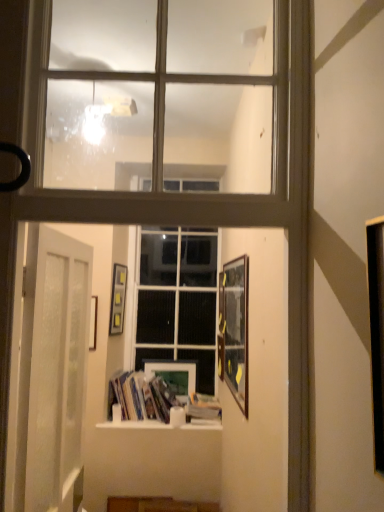
You are a GUI agent. You are given a task and a screenshot of the screen. Output one action in this format:
    pyautogui.click(x=<x>, y=<y>)
    Task: Click on the clear glass window at center
    This screenshot has height=512, width=384.
    Given the screenshot: What is the action you would take?
    pyautogui.click(x=178, y=298)

This screenshot has width=384, height=512. What are the coordinates of `matte wooden picture frame at center, the second picture frame in the right-to-left sequence` in the screenshot? It's located at (174, 374).

Image resolution: width=384 pixels, height=512 pixels. Find the location of `hardcover book at center`. hardcover book at center is located at coordinates (203, 408).

Find the location of `matte black picture frame at center, which ranks as the 2th picture frame in front-to-back order`. matte black picture frame at center, which ranks as the 2th picture frame in front-to-back order is located at coordinates (118, 298).

You are a GUI agent. You are given a task and a screenshot of the screen. Output one action in this format:
    pyautogui.click(x=<x>, y=<y>)
    Task: Click on the clear glass window at upper center
    
    Given the screenshot: What is the action you would take?
    pyautogui.click(x=219, y=93)

From a real-world perspective, which is physically above, clear glass window at center or matte wooden picture frame at center, the first picture frame viewed from the back?

clear glass window at center is physically above.

Between clear glass window at center and matte wooden picture frame at center, the second picture frame in the right-to-left sequence, which one has more height?

clear glass window at center is taller.

How many degrees apart are the facing directions of clear glass window at center and matte wooden picture frame at center, the second picture frame in the right-to-left sequence?

The facing directions of clear glass window at center and matte wooden picture frame at center, the second picture frame in the right-to-left sequence, are 0.317 degrees apart.

Considering the positions of objects clear glass window at center and matte wooden picture frame at center, which is counted as the 3th picture frame, starting from the front, in the image provided, who is in front, clear glass window at center or matte wooden picture frame at center, which is counted as the 3th picture frame, starting from the front,?

clear glass window at center.

Could you tell me if matte black picture frame at center, which ranks as the second picture frame in back-to-front order, is facing matte wooden picture frame at center, which is counted as the 3th picture frame, starting from the front?

No.

Is matte black picture frame at center, which ranks as the 2th picture frame in front-to-back order, further to the viewer compared to matte wooden picture frame at center, arranged as the 2th picture frame when viewed from the left?

No, matte black picture frame at center, which ranks as the 2th picture frame in front-to-back order, is closer to the viewer.

You are a GUI agent. You are given a task and a screenshot of the screen. Output one action in this format:
    pyautogui.click(x=<x>, y=<y>)
    Task: Click on the 2nd picture frame above the matte wooden picture frame at center, which is counted as the 3th picture frame, starting from the front (from the image's perspective)
    This screenshot has height=512, width=384.
    Given the screenshot: What is the action you would take?
    pyautogui.click(x=118, y=298)

Is matte black picture frame at center, which ranks as the second picture frame in back-to-front order, placed right next to matte wooden picture frame at center, the first picture frame viewed from the back?

There is a gap between matte black picture frame at center, which ranks as the second picture frame in back-to-front order, and matte wooden picture frame at center, the first picture frame viewed from the back.

Is hardcover book at center bigger or smaller than matte wooden picture frame at center, arranged as the 2th picture frame when viewed from the left?

hardcover book at center is bigger than matte wooden picture frame at center, arranged as the 2th picture frame when viewed from the left.

How many degrees apart are the facing directions of hardcover book at center and matte wooden picture frame at center, the second picture frame in the right-to-left sequence?

0.753 degrees.

Is the position of hardcover book at center less distant than that of matte wooden picture frame at center, the first picture frame viewed from the back?

Yes, hardcover book at center is closer to the viewer.

Could you tell me if hardcover book at center is turned towards matte wooden picture frame at center, arranged as the 2th picture frame when viewed from the left?

No.

Is clear glass window at center wider or thinner than hardcover books at center?

In the image, clear glass window at center appears to be more narrow than hardcover books at center.

From a real-world perspective, is clear glass window at center located beneath hardcover books at center?

No, from a real-world perspective, clear glass window at center is not under hardcover books at center.

Considering the positions of point (138, 369) and point (168, 410), is point (138, 369) closer or farther from the camera than point (168, 410)?

Point (138, 369) appears to be farther away from the viewer than point (168, 410).

How different are the orientations of clear glass window at upper center and matte wooden picture frame at center, the second picture frame in the right-to-left sequence, in degrees?

The angular difference between clear glass window at upper center and matte wooden picture frame at center, the second picture frame in the right-to-left sequence, is 179 degrees.

Identify the location of bay window on the right of matte wooden picture frame at center, the second picture frame in the right-to-left sequence. This screenshot has height=512, width=384. (219, 93).

Consider the image. From a real-world perspective, is clear glass window at upper center under matte wooden picture frame at center, which is counted as the 3th picture frame, starting from the front?

No, from a real-world perspective, clear glass window at upper center is not under matte wooden picture frame at center, which is counted as the 3th picture frame, starting from the front.

Is clear glass window at upper center far away from matte wooden picture frame at center, the first picture frame viewed from the back?

That's right, there is a large distance between clear glass window at upper center and matte wooden picture frame at center, the first picture frame viewed from the back.

Which of these two, wooden framed picture at right, which appears as the first picture frame when viewed from the right, or hardcover book at center, is smaller?

hardcover book at center.

In the scene shown: From the image's perspective, is wooden framed picture at right, arranged as the first picture frame when viewed from the front, positioned above or below hardcover book at center?

wooden framed picture at right, arranged as the first picture frame when viewed from the front, is above hardcover book at center.

Is point (219, 338) positioned before point (190, 414)?

That is True.

Considering the relative sizes of wooden framed picture at right, which appears as the first picture frame when viewed from the right, and hardcover book at center in the image provided, is wooden framed picture at right, which appears as the first picture frame when viewed from the right, shorter than hardcover book at center?

In fact, wooden framed picture at right, which appears as the first picture frame when viewed from the right, may be taller than hardcover book at center.

In the scene shown: From a real-world perspective, who is located higher, clear glass window at upper center or wooden framed picture at right, arranged as the first picture frame when viewed from the front?

In real-world perspective, clear glass window at upper center is above.

Considering the sizes of clear glass window at upper center and wooden framed picture at right, arranged as the third picture frame when viewed from the back, in the image, is clear glass window at upper center wider or thinner than wooden framed picture at right, arranged as the third picture frame when viewed from the back,?

Clearly, clear glass window at upper center has more width compared to wooden framed picture at right, arranged as the third picture frame when viewed from the back.

From the image's perspective, between clear glass window at upper center and wooden framed picture at right, arranged as the third picture frame when viewed from the back, who is located below?

wooden framed picture at right, arranged as the third picture frame when viewed from the back.

Identify the location of window on the right of matte wooden picture frame at center, arranged as the 2th picture frame when viewed from the left. (178, 298).

The width and height of the screenshot is (384, 512). In order to click on picture frame on the left of matte wooden picture frame at center, which is counted as the 3th picture frame, starting from the front in this screenshot , I will do `click(118, 298)`.

Estimate the real-world distances between objects in this image. Which object is closer to clear glass window at upper center, matte black picture frame at center, which is the first picture frame from left to right, or hardcover books at center?

Based on the image, matte black picture frame at center, which is the first picture frame from left to right, appears to be nearer to clear glass window at upper center.

When comparing their distances from hardcover books at center, does matte black picture frame at center, which ranks as the second picture frame in back-to-front order, or white frosted glass door at left seem closer?

matte black picture frame at center, which ranks as the second picture frame in back-to-front order, is closer to hardcover books at center.

Based on their spatial positions, is clear glass window at center or matte black picture frame at center, which is the first picture frame from left to right, further from hardcover books at center?

Based on the image, matte black picture frame at center, which is the first picture frame from left to right, appears to be further to hardcover books at center.

From the image, which object appears to be farther from matte black picture frame at center, which ranks as the second picture frame in back-to-front order, white frosted glass door at left or clear glass window at center?

white frosted glass door at left.

Considering their positions, is wooden framed picture at right, arranged as the first picture frame when viewed from the front, positioned closer to clear glass window at center than white frosted glass door at left?

wooden framed picture at right, arranged as the first picture frame when viewed from the front, is closer to clear glass window at center.

From the image, which object appears to be farther from wooden framed picture at right, arranged as the third picture frame when viewed from the back, matte black picture frame at center, which ranks as the 2th picture frame in front-to-back order, or clear glass window at upper center?

The object further to wooden framed picture at right, arranged as the third picture frame when viewed from the back, is clear glass window at upper center.

Based on their spatial positions, is hardcover book at center or clear glass window at center closer to clear glass window at upper center?

clear glass window at center.

When comparing their distances from hardcover books at center, does matte wooden picture frame at center, which is counted as the 3th picture frame, starting from the front, or clear glass window at upper center seem closer?

The object closer to hardcover books at center is matte wooden picture frame at center, which is counted as the 3th picture frame, starting from the front.

You are a GUI agent. You are given a task and a screenshot of the screen. Output one action in this format:
    pyautogui.click(x=<x>, y=<y>)
    Task: Click on the paperback book located between white frosted glass door at left and matte wooden picture frame at center, which is counted as the 3th picture frame, starting from the front, in the depth direction
    This screenshot has height=512, width=384.
    Given the screenshot: What is the action you would take?
    pyautogui.click(x=203, y=408)

You are a GUI agent. You are given a task and a screenshot of the screen. Output one action in this format:
    pyautogui.click(x=<x>, y=<y>)
    Task: Click on the window between matte black picture frame at center, which ranks as the second picture frame in back-to-front order, and hardcover book at center in the up-down direction
    The width and height of the screenshot is (384, 512).
    Given the screenshot: What is the action you would take?
    pyautogui.click(x=178, y=298)

This screenshot has width=384, height=512. In order to click on book between clear glass window at upper center and clear glass window at center from front to back in this screenshot , I will do `click(155, 399)`.

Where is `book positioned between white frosted glass door at left and hardcover book at center from near to far`? book positioned between white frosted glass door at left and hardcover book at center from near to far is located at coordinates click(x=155, y=399).